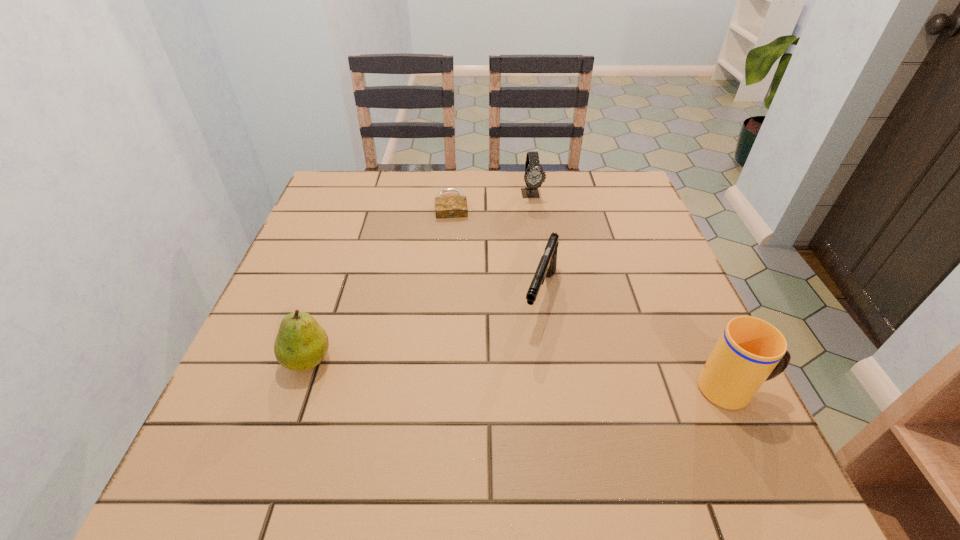
Image resolution: width=960 pixels, height=540 pixels. Find the location of `vacant space located on the keyhole side of the shortest object`. vacant space located on the keyhole side of the shortest object is located at coordinates (457, 306).

The image size is (960, 540). What are the coordinates of `free region located on the keyhole side of the shortest object` in the screenshot? It's located at click(x=455, y=264).

You are a GUI agent. You are given a task and a screenshot of the screen. Output one action in this format:
    pyautogui.click(x=<x>, y=<y>)
    Task: Click on the vacant space situated 0.160m on the keyhole side of the shortest object
    The image size is (960, 540).
    Given the screenshot: What is the action you would take?
    pyautogui.click(x=454, y=256)

Find the location of `vacant position located on the face of the watch`. vacant position located on the face of the watch is located at coordinates (549, 274).

Where is `free space located 0.170m on the face of the watch`? free space located 0.170m on the face of the watch is located at coordinates (541, 240).

Where is `free region located on the face of the watch`? free region located on the face of the watch is located at coordinates (537, 220).

This screenshot has height=540, width=960. In order to click on padlock present at the far edge in this screenshot , I will do `click(446, 206)`.

The height and width of the screenshot is (540, 960). Identify the location of watch located at the far edge. (534, 176).

Find the location of a particular element. object that is at the near edge is located at coordinates (750, 351).

Identify the location of object present at the left edge. This screenshot has height=540, width=960. (301, 344).